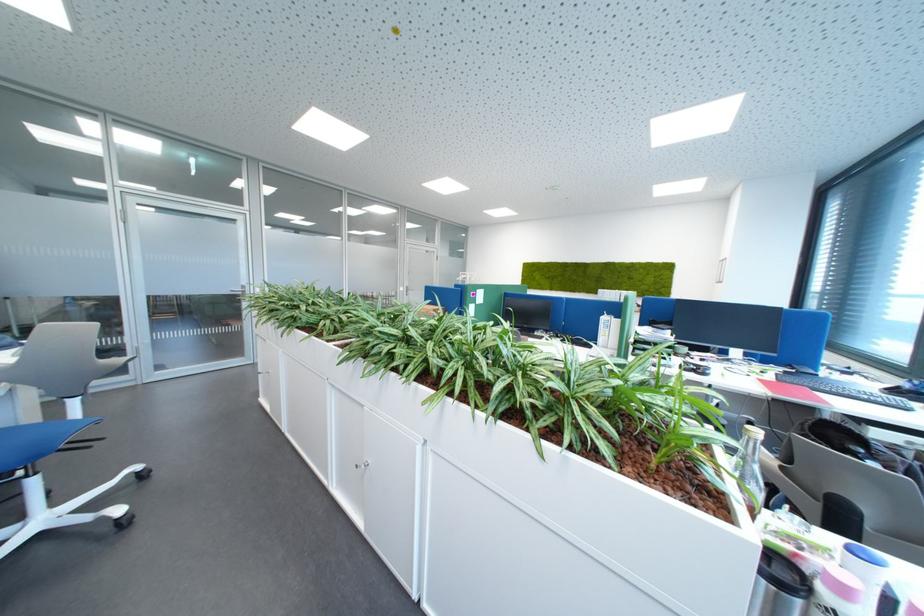
Which object does [836,593] point to?

It refers to a pink capped bottle.